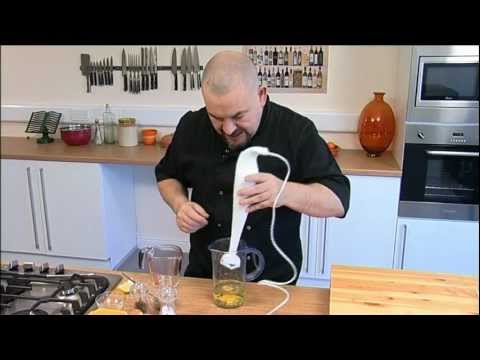
I want to click on measuring cup, so [181, 269].